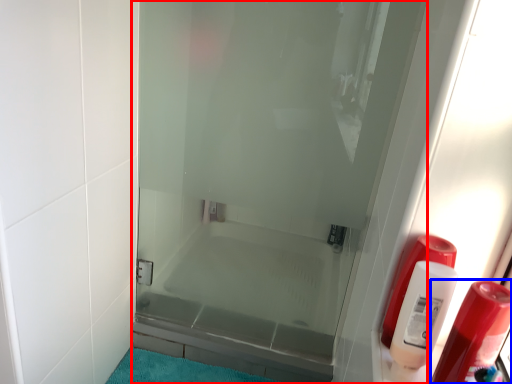
Question: Which object is further to the camera taking this photo, door (highlighted by a red box) or soap dispenser (highlighted by a blue box)?

Choices:
 (A) door
 (B) soap dispenser

Answer: (A)